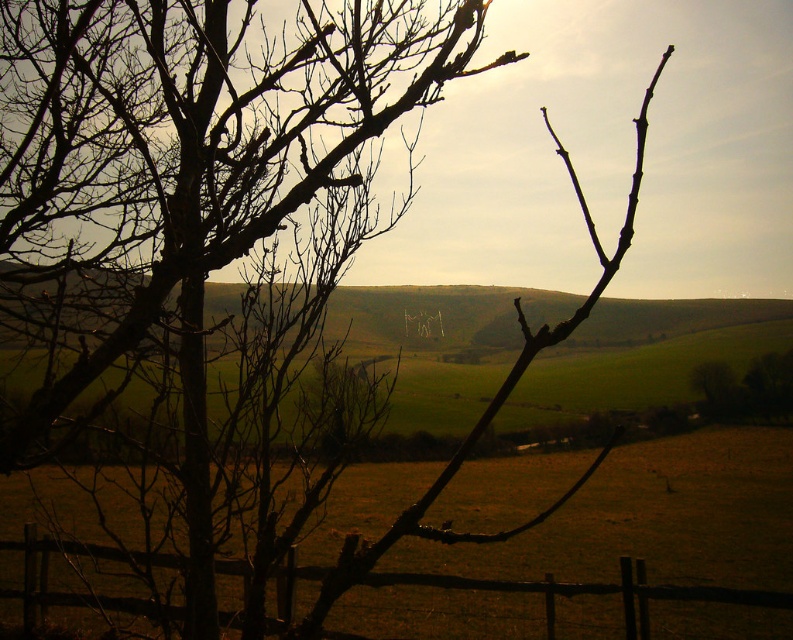
Between point (401, 52) and point (286, 579), which one is positioned behind?

Point (286, 579)

Where is `brown rough branches at left`? brown rough branches at left is located at coordinates coord(178,182).